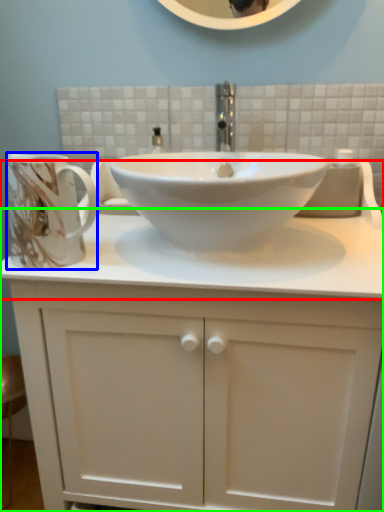
Question: Which object is positioned closest to counter top (highlighted by a red box)? Select from mug (highlighted by a blue box) and bathroom cabinet (highlighted by a green box).

Choices:
 (A) mug
 (B) bathroom cabinet

Answer: (B)